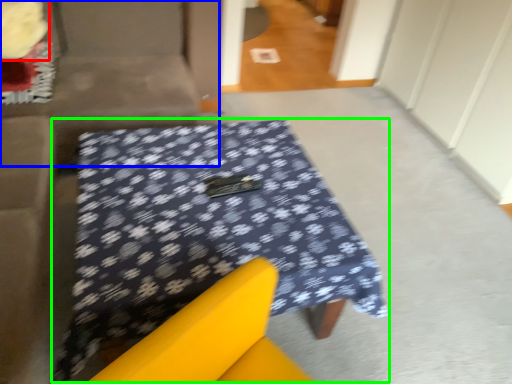
Question: Which object is positioned closest to flower (highlighted by a red box)? Select from couch (highlighted by a blue box) and table (highlighted by a green box).

Choices:
 (A) couch
 (B) table

Answer: (A)